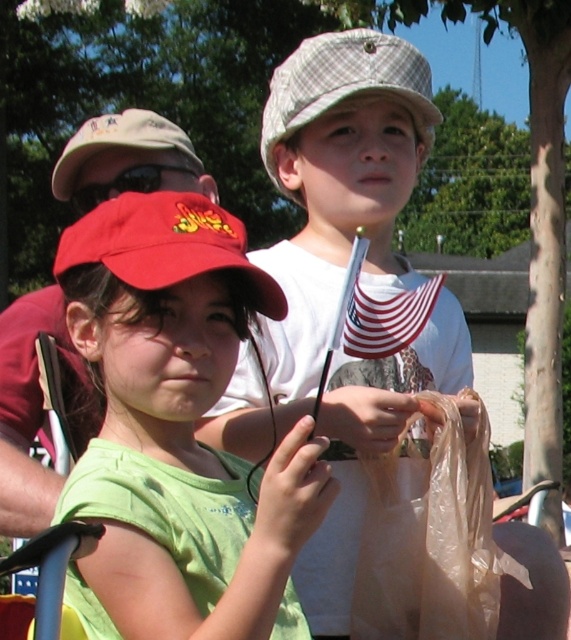
Question: Which of the following is the closest to the observer?

Choices:
 (A) (234, 355)
 (B) (195, 161)
 (C) (325, 74)

Answer: (A)

Question: Can you confirm if translucent plastic bag at lower right is smaller than matte red baseball cap at center?

Choices:
 (A) no
 (B) yes

Answer: (B)

Question: Which object is the closest to the plaid fabric baseball cap at upper center?

Choices:
 (A) matte khaki baseball cap at upper left
 (B) translucent plastic bag at lower right

Answer: (B)

Question: Can you confirm if matte red baseball cap at center is wider than plaid fabric baseball cap at upper center?

Choices:
 (A) yes
 (B) no

Answer: (A)

Question: Is matte red cap at center above plaid fabric baseball cap at upper center?

Choices:
 (A) no
 (B) yes

Answer: (A)

Question: Which of the following is the closest to the observer?

Choices:
 (A) matte red cap at center
 (B) matte khaki baseball cap at upper left
 (C) white cotton shirt at center
 (D) matte red baseball cap at center

Answer: (A)